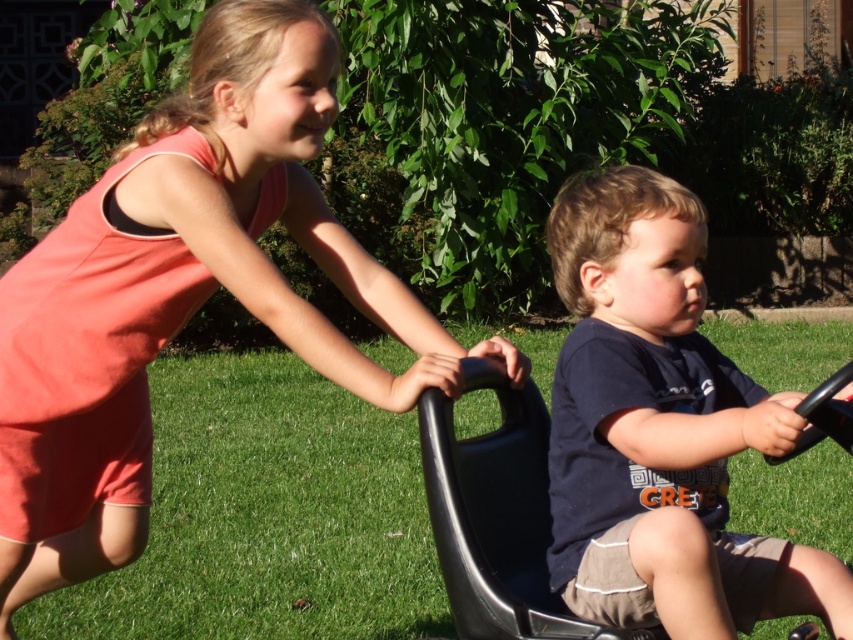
Question: Which object is closer to the camera taking this photo?

Choices:
 (A) green grass at center
 (B) dark blue t-shirt at center

Answer: (B)

Question: Considering the real-world distances, which object is closest to the green grass at center?

Choices:
 (A) dark blue t-shirt at center
 (B) matte pink dress at upper left

Answer: (B)

Question: Which point is farther to the camera?

Choices:
 (A) (x=566, y=381)
 (B) (x=409, y=618)
 (C) (x=343, y=275)

Answer: (B)

Question: Observing the image, what is the correct spatial positioning of green grass at center in reference to dark blue t-shirt at center?

Choices:
 (A) right
 (B) left

Answer: (B)

Question: Can you confirm if matte pink dress at upper left is positioned to the left of dark blue t-shirt at center?

Choices:
 (A) no
 (B) yes

Answer: (B)

Question: Is the position of green grass at center more distant than that of dark blue t-shirt at center?

Choices:
 (A) no
 (B) yes

Answer: (B)